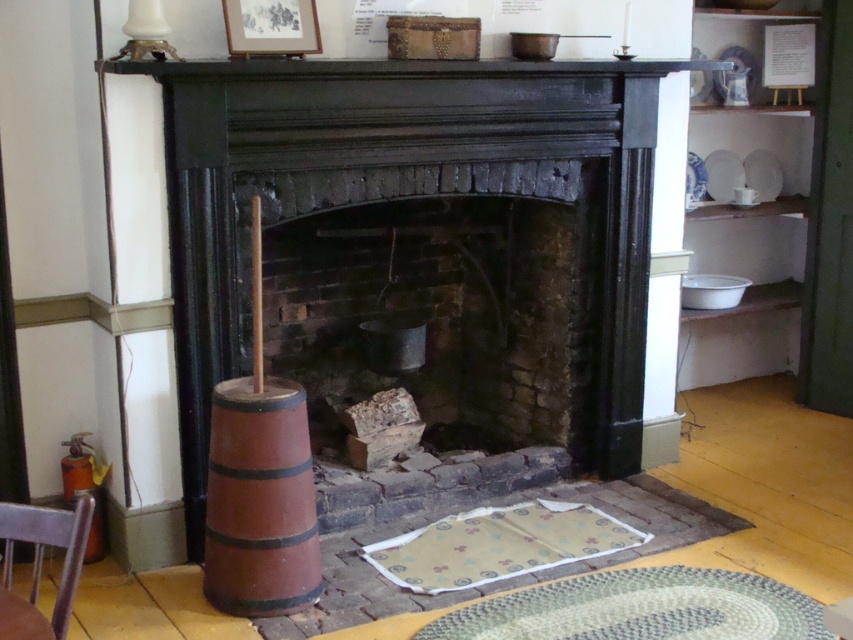
Does point (207, 333) lie in front of point (293, 490)?

No.

Who is taller, black painted wood fireplace at center or brown wooden barrel at left?

black painted wood fireplace at center

Describe the element at coordinates (407, 196) in the screenshot. The image size is (853, 640). I see `black painted wood fireplace at center` at that location.

Where is `black painted wood fireplace at center`? Image resolution: width=853 pixels, height=640 pixels. black painted wood fireplace at center is located at coordinates (407, 196).

Is black painted wood fireplace at center bigger than smooth dark wood mantle at upper center?

Yes.

Where is `black painted wood fireplace at center`? Image resolution: width=853 pixels, height=640 pixels. black painted wood fireplace at center is located at coordinates (407, 196).

Which is more to the left, black painted wood fireplace at center or brown wooden chair at lower left?

From the viewer's perspective, brown wooden chair at lower left appears more on the left side.

Who is more forward, (614, 212) or (9, 538)?

Positioned in front is point (9, 538).

The width and height of the screenshot is (853, 640). I want to click on black painted wood fireplace at center, so click(x=407, y=196).